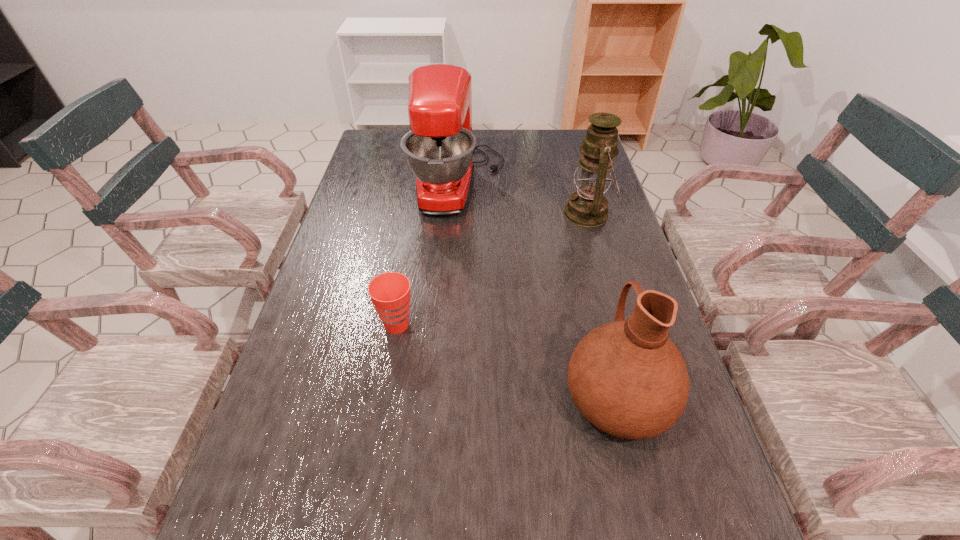
This screenshot has height=540, width=960. I want to click on free region that satisfies the following two spatial constraints: 1. on the back side of the cup; 2. on the right side of the oil lamp, so click(416, 214).

Locate an element on the screen. free space that satisfies the following two spatial constraints: 1. on the front-facing side of the kitchen mixer; 2. on the right side of the oil lamp is located at coordinates (457, 214).

Image resolution: width=960 pixels, height=540 pixels. Find the location of `vacant point that satisfies the following two spatial constraints: 1. on the front-facing side of the oil lamp; 2. on the right side of the kitchen mixer`. vacant point that satisfies the following two spatial constraints: 1. on the front-facing side of the oil lamp; 2. on the right side of the kitchen mixer is located at coordinates pos(457,214).

The width and height of the screenshot is (960, 540). What are the coordinates of `free space that satisfies the following two spatial constraints: 1. on the side of the nearest object with the handle; 2. on the left side of the oil lamp` in the screenshot? It's located at tap(572, 214).

In order to click on vacant space that satisfies the following two spatial constraints: 1. on the front-facing side of the kitchen mixer; 2. on the side of the nearest object with the handle in this screenshot , I will do `click(445, 396)`.

At what (x,y) coordinates should I click in order to perform the action: click on free region that satisfies the following two spatial constraints: 1. on the front-facing side of the kitchen mixer; 2. on the side of the pitcher with the handle. Please return your answer as a coordinate pair (x, y). The width and height of the screenshot is (960, 540). Looking at the image, I should click on (445, 396).

The image size is (960, 540). What are the coordinates of `vacant point that satisfies the following two spatial constraints: 1. on the side of the oil lamp with the handle; 2. on the left side of the nearest object` in the screenshot? It's located at (572, 214).